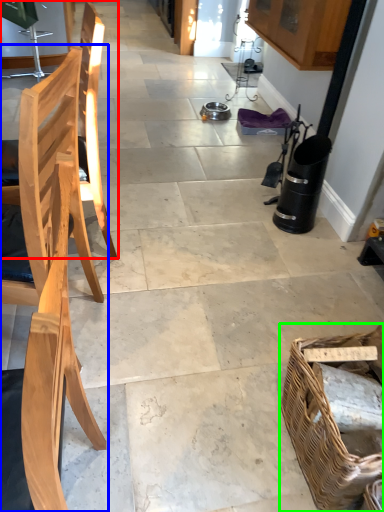
Question: Which object is positioned closest to chair (highlighted by a red box)? Select from chair (highlighted by a blue box) and picnic basket (highlighted by a green box).

Choices:
 (A) chair
 (B) picnic basket

Answer: (A)